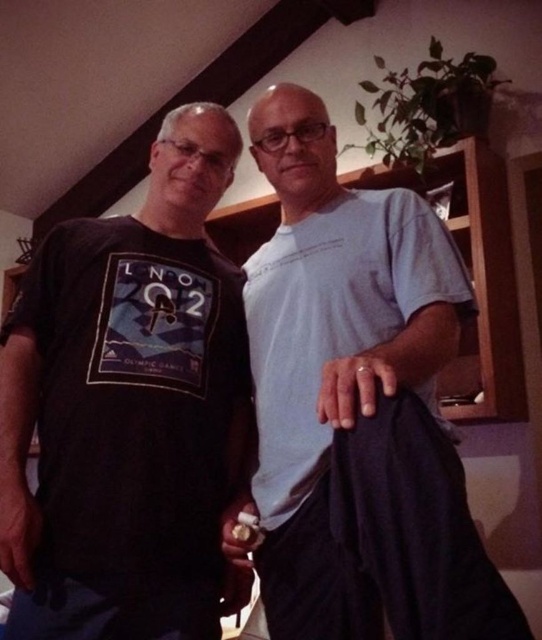
Does black matte t-shirt at left have a greater width compared to light blue cotton t-shirt at center?

Result: Yes, black matte t-shirt at left is wider than light blue cotton t-shirt at center.

Is black matte t-shirt at left shorter than light blue cotton t-shirt at center?

Correct, black matte t-shirt at left is not as tall as light blue cotton t-shirt at center.

Find the location of a particular element. black matte t-shirt at left is located at coordinates (127, 410).